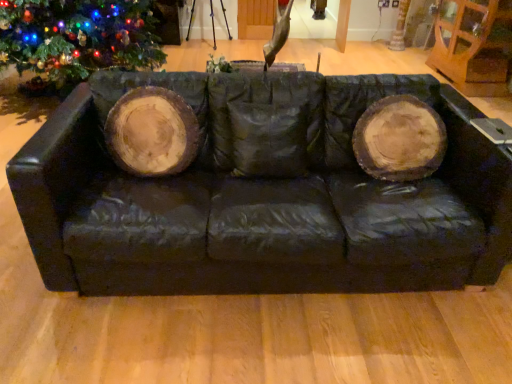
Locate an element on the screen. The width and height of the screenshot is (512, 384). free space behind brown wood tree trunk at upper right is located at coordinates (385, 48).